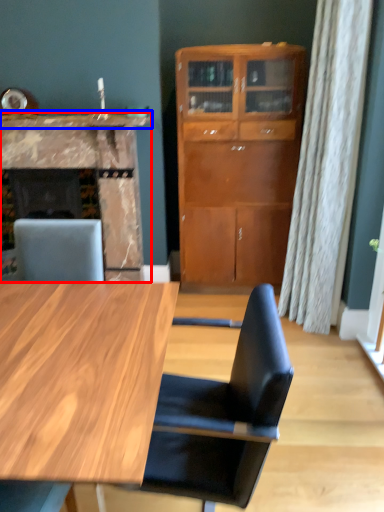
Question: Among these objects, which one is nearest to the camera, fireplace (highlighted by a red box) or counter top (highlighted by a blue box)?

Choices:
 (A) fireplace
 (B) counter top

Answer: (B)